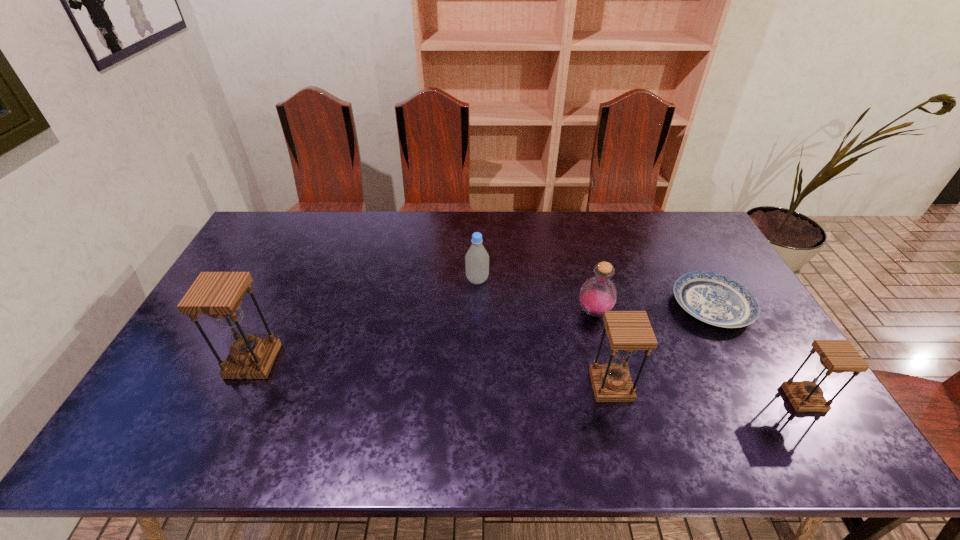
The width and height of the screenshot is (960, 540). What are the coordinates of `free space at the near edge of the desktop` in the screenshot? It's located at (429, 386).

Where is `vacant space at the left edge`? The image size is (960, 540). vacant space at the left edge is located at coordinates (179, 367).

This screenshot has height=540, width=960. I want to click on vacant space at the far left corner of the desktop, so click(275, 233).

Identify the location of vacant point at the far right corner. (668, 238).

Image resolution: width=960 pixels, height=540 pixels. I want to click on free space that is in between the plate and the right bottle, so click(653, 309).

Locate an element on the screen. free space between the farther bottle and the nearer bottle is located at coordinates (536, 296).

At what (x,y) coordinates should I click in order to perform the action: click on free space between the tallest object and the rightmost hourglass. Please return your answer as a coordinate pair (x, y). Image resolution: width=960 pixels, height=540 pixels. Looking at the image, I should click on (528, 380).

Where is `vacant region between the shortest object and the second hourglass from left to right`? vacant region between the shortest object and the second hourglass from left to right is located at coordinates (661, 346).

The width and height of the screenshot is (960, 540). I want to click on empty space between the fifth object from right to left and the second tallest object, so click(x=544, y=333).

Locate an element on the screen. This screenshot has height=540, width=960. empty space that is in between the shortest object and the right bottle is located at coordinates (653, 309).